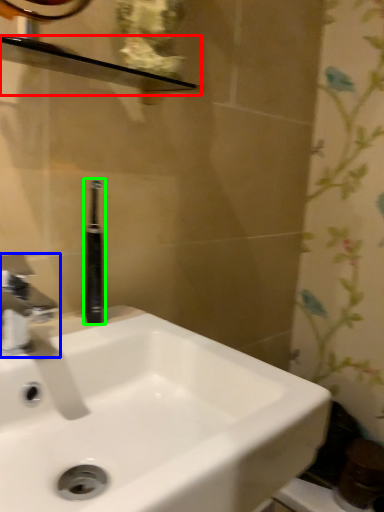
Question: Which is nearer to the balustrade (highlighted by a red box)? tap (highlighted by a blue box) or toiletry (highlighted by a green box).

Choices:
 (A) tap
 (B) toiletry

Answer: (B)